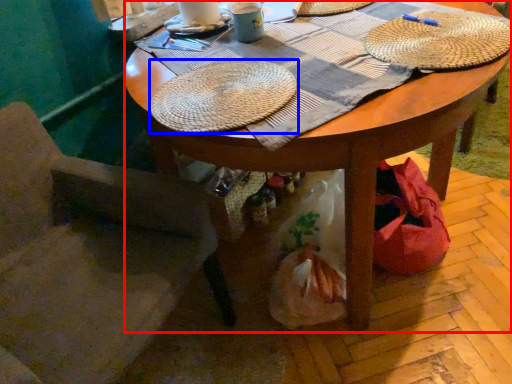
Question: Which of the following is the closest to the observer, desk (highlighted by a red box) or hat (highlighted by a blue box)?

Choices:
 (A) desk
 (B) hat

Answer: (A)